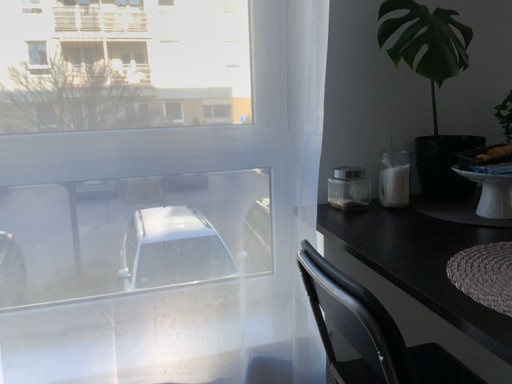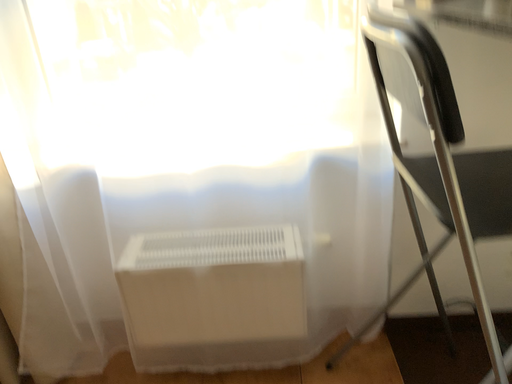
Question: Which way did the camera rotate in the video?

Choices:
 (A) rotated upward
 (B) rotated downward

Answer: (B)